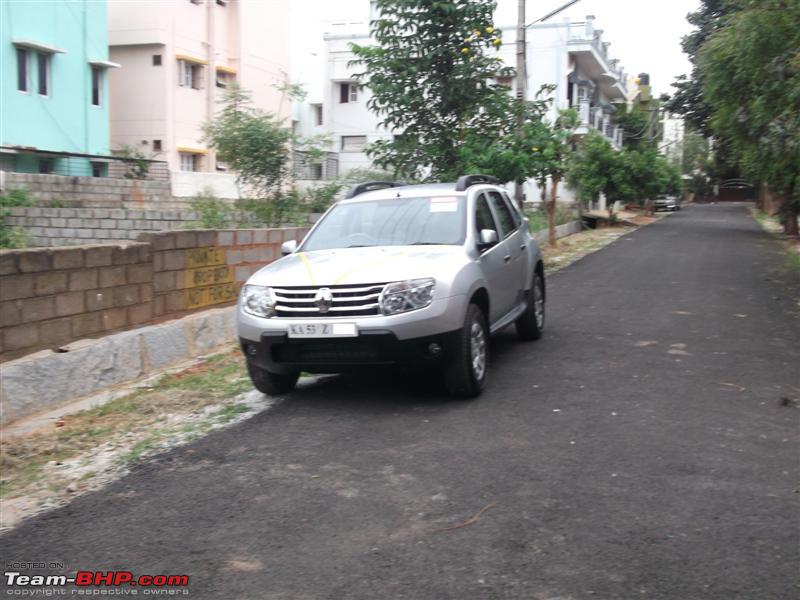
The height and width of the screenshot is (600, 800). Identify the location of wall. (73, 324), (234, 265), (258, 259), (72, 223), (122, 186), (150, 186).